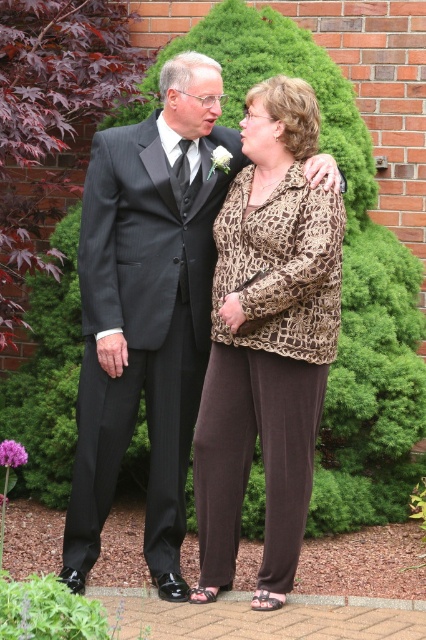
Question: Does leopard print blouse at center have a lesser width compared to dark gray pinstripe suit at left?

Choices:
 (A) yes
 (B) no

Answer: (A)

Question: Does leopard print blouse at center have a larger size compared to dark gray pinstripe suit at left?

Choices:
 (A) no
 (B) yes

Answer: (A)

Question: Which point is farther to the camera?

Choices:
 (A) dark gray pinstripe suit at left
 (B) leopard print blouse at center

Answer: (A)

Question: Is leopard print blouse at center bigger than dark gray pinstripe suit at left?

Choices:
 (A) yes
 (B) no

Answer: (B)

Question: Which object is closer to the camera taking this photo?

Choices:
 (A) leopard print blouse at center
 (B) dark gray pinstripe suit at left

Answer: (A)